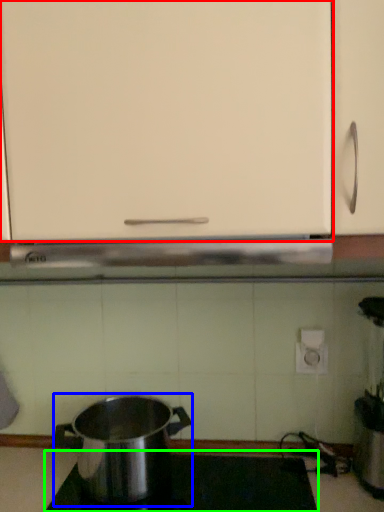
Question: Which is farther away from cabinetry (highlighted by a red box)? kitchen appliance (highlighted by a blue box) or gas stove (highlighted by a green box)?

Choices:
 (A) kitchen appliance
 (B) gas stove

Answer: (B)